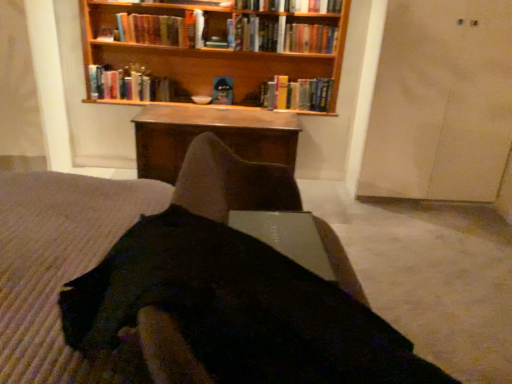
Question: Is hardcover book at upper center, placed as the 5th book when sorted from left to right, in contact with hardcover book at center, the 4th book when ordered from right to left?

Choices:
 (A) yes
 (B) no

Answer: (B)

Question: From the image's perspective, is hardcover book at upper center, placed as the 5th book when sorted from left to right, located beneath hardcover book at center, the 4th book when ordered from right to left?

Choices:
 (A) yes
 (B) no

Answer: (B)

Question: Can you confirm if hardcover book at upper center, the 2th book from the right, is taller than hardcover book at center, acting as the third book starting from the left?

Choices:
 (A) no
 (B) yes

Answer: (B)

Question: Is hardcover book at upper center, placed as the 5th book when sorted from left to right, in front of hardcover book at center, the 4th book when ordered from right to left?

Choices:
 (A) yes
 (B) no

Answer: (A)

Question: From a real-world perspective, is hardcover book at upper center, placed as the 5th book when sorted from left to right, on top of hardcover book at center, the 4th book when ordered from right to left?

Choices:
 (A) yes
 (B) no

Answer: (A)

Question: From a real-world perspective, is wooden table at center physically located above or below hardcover book at center, the 4th book when ordered from right to left?

Choices:
 (A) below
 (B) above

Answer: (A)

Question: From the image's perspective, is wooden table at center located above or below hardcover book at center, the 4th book when ordered from right to left?

Choices:
 (A) below
 (B) above

Answer: (A)

Question: Looking at the image, does wooden table at center seem bigger or smaller compared to hardcover book at center, the 4th book when ordered from right to left?

Choices:
 (A) big
 (B) small

Answer: (A)

Question: Is wooden table at center in front of or behind hardcover book at center, the 4th book when ordered from right to left, in the image?

Choices:
 (A) behind
 (B) front

Answer: (B)

Question: Choose the correct answer: Is hardcover book at upper center, placed as the 5th book when sorted from left to right, inside hardcover book at center, the 4th book when ordered from right to left, or outside it?

Choices:
 (A) outside
 (B) inside

Answer: (A)

Question: From their relative heights in the image, would you say hardcover book at upper center, the 2th book from the right, is taller or shorter than hardcover book at center, acting as the third book starting from the left?

Choices:
 (A) short
 (B) tall

Answer: (B)

Question: From the image's perspective, relative to hardcover book at center, acting as the third book starting from the left, is hardcover book at upper center, the 2th book from the right, above or below?

Choices:
 (A) above
 (B) below

Answer: (A)

Question: From a real-world perspective, is hardcover book at upper center, placed as the 5th book when sorted from left to right, above or below hardcover book at center, acting as the third book starting from the left?

Choices:
 (A) above
 (B) below

Answer: (A)

Question: Considering the positions of black fabric dress at center and wooden bookshelf at upper center in the image, is black fabric dress at center wider or thinner than wooden bookshelf at upper center?

Choices:
 (A) thin
 (B) wide

Answer: (B)

Question: Is black fabric dress at center in front of or behind wooden bookshelf at upper center in the image?

Choices:
 (A) behind
 (B) front

Answer: (B)